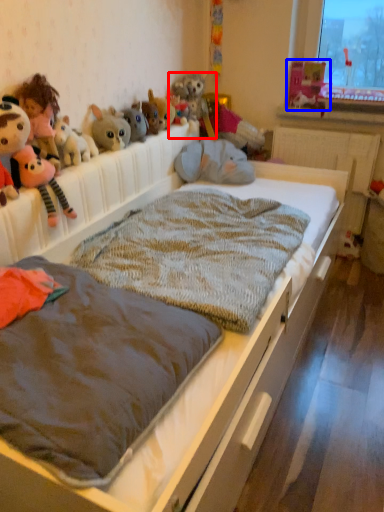
Question: Among these objects, which one is nearest to the camera, toy (highlighted by a red box) or toy (highlighted by a blue box)?

Choices:
 (A) toy
 (B) toy

Answer: (A)